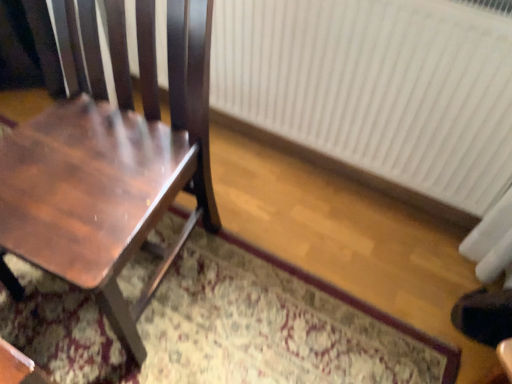
Where is `free space to the right of shiny brown wood chair at left`? free space to the right of shiny brown wood chair at left is located at coordinates (261, 310).